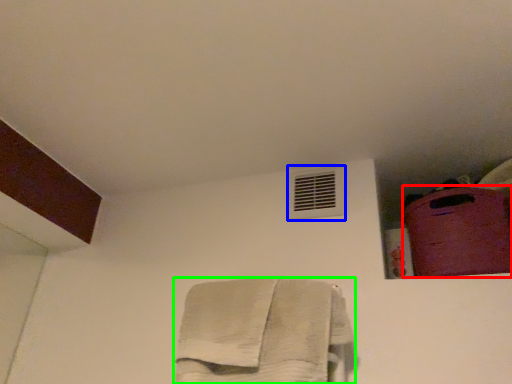
Question: Based on their relative distances, which object is nearer to luggage (highlighted by a red box)? Choose from air conditioning (highlighted by a blue box) and towel (highlighted by a green box).

Choices:
 (A) air conditioning
 (B) towel

Answer: (A)